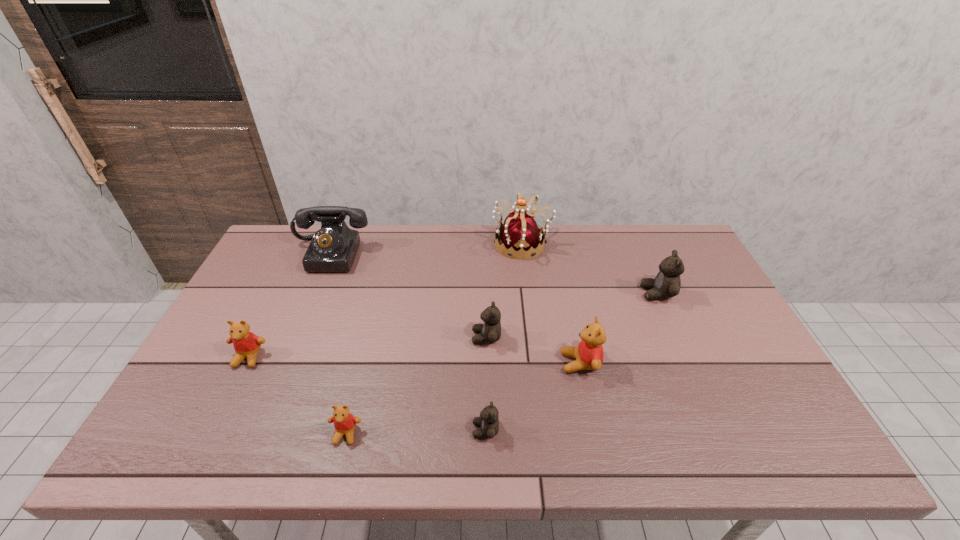
The width and height of the screenshot is (960, 540). I want to click on blank space that satisfies the following two spatial constraints: 1. on the front-facing side of the tiara; 2. on the dial of the telephone, so click(523, 254).

Locate an element on the screen. This screenshot has height=540, width=960. free point that satisfies the following two spatial constraints: 1. on the face of the second farthest brown teddy bear; 2. on the front-facing side of the fifth teddy bear from right to left is located at coordinates (488, 434).

This screenshot has width=960, height=540. What are the coordinates of `free spot that satisfies the following two spatial constraints: 1. on the face of the rightmost brown teddy bear; 2. on the front-facing side of the second biggest red teddy bear` in the screenshot? It's located at (685, 357).